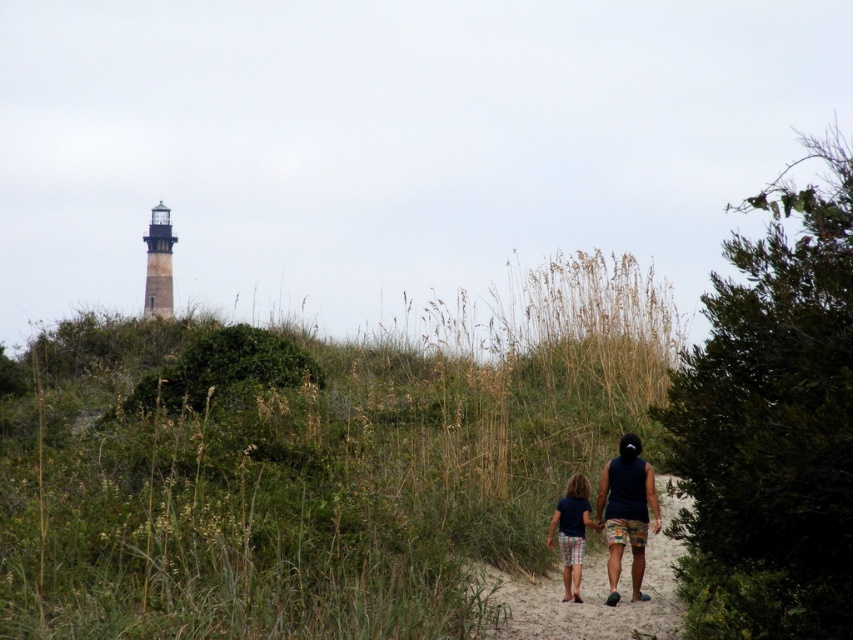
Is point (619, 484) positioned in front of point (587, 493)?

No.

Between dark blue tank top at center and plaid shorts at center, which one has less height?

With less height is plaid shorts at center.

In order to click on dark blue tank top at center in this screenshot , I will do `click(625, 513)`.

Which of these two, green grassy at center or plaid shorts at center, stands shorter?

plaid shorts at center is shorter.

Which is in front, point (612, 323) or point (573, 554)?

Point (573, 554) is in front.

Where is `green grassy at center`? This screenshot has height=640, width=853. green grassy at center is located at coordinates (312, 465).

Is textured sand path at center bigger than dark blue tank top at center?

Correct, textured sand path at center is larger in size than dark blue tank top at center.

This screenshot has width=853, height=640. Describe the element at coordinates (595, 592) in the screenshot. I see `textured sand path at center` at that location.

Where is `textured sand path at center`? textured sand path at center is located at coordinates (595, 592).